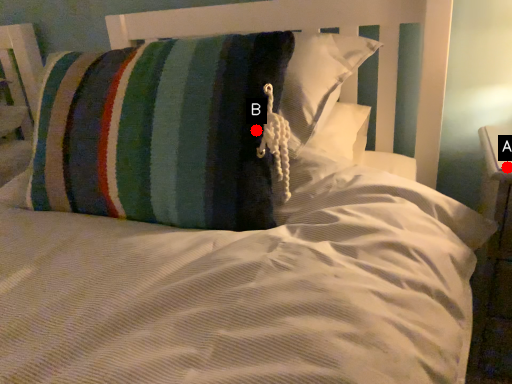
Question: Two points are circled on the image, labeled by A and B beside each circle. Which point is closer to the camera?

Choices:
 (A) A is closer
 (B) B is closer

Answer: (B)